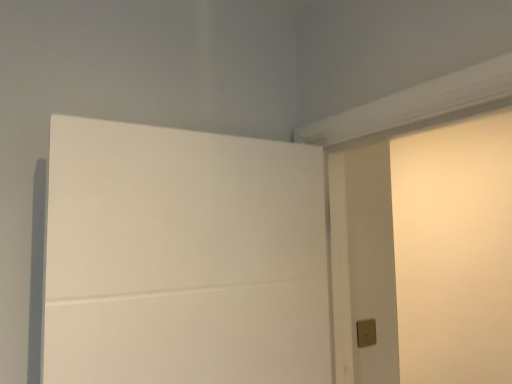
At what (x,y) coordinates should I click in order to perform the action: click on white matte door at upper left. Please return your answer as a coordinate pair (x, y). This screenshot has height=384, width=512. Looking at the image, I should click on (183, 258).

The image size is (512, 384). Describe the element at coordinates (183, 258) in the screenshot. I see `white matte door at upper left` at that location.

Where is `matte beige light switch at lower right`? matte beige light switch at lower right is located at coordinates (366, 332).

The width and height of the screenshot is (512, 384). Describe the element at coordinates (366, 332) in the screenshot. I see `matte beige light switch at lower right` at that location.

The height and width of the screenshot is (384, 512). Identify the location of white matte door at upper left. [183, 258].

Which object is positioned more to the right, matte beige light switch at lower right or white matte door at upper left?

matte beige light switch at lower right is more to the right.

Between matte beige light switch at lower right and white matte door at upper left, which one is positioned in front?

white matte door at upper left.

Which is farther, (366, 323) or (50, 270)?

The point (366, 323) is behind.

From the image's perspective, is matte beige light switch at lower right located above or below white matte door at upper left?

matte beige light switch at lower right is below white matte door at upper left.

From a real-world perspective, does matte beige light switch at lower right sit lower than white matte door at upper left?

Yes, from a real-world perspective, matte beige light switch at lower right is below white matte door at upper left.

Is matte beige light switch at lower right wider or thinner than white matte door at upper left?

Considering their sizes, matte beige light switch at lower right looks slimmer than white matte door at upper left.

Between matte beige light switch at lower right and white matte door at upper left, which one has less height?

Standing shorter between the two is matte beige light switch at lower right.

In terms of size, does matte beige light switch at lower right appear bigger or smaller than white matte door at upper left?

Considering their sizes, matte beige light switch at lower right takes up less space than white matte door at upper left.

Is white matte door at upper left a part of matte beige light switch at lower right?

No, white matte door at upper left is not inside matte beige light switch at lower right.

Based on the photo, are matte beige light switch at lower right and white matte door at upper left making contact?

No, matte beige light switch at lower right is not beside white matte door at upper left.

Is matte beige light switch at lower right facing towards white matte door at upper left?

No, matte beige light switch at lower right is not oriented towards white matte door at upper left.

How many degrees apart are the facing directions of matte beige light switch at lower right and white matte door at upper left?

There is a 1.89-degree angle between the facing directions of matte beige light switch at lower right and white matte door at upper left.

How distant is matte beige light switch at lower right from white matte door at upper left?

matte beige light switch at lower right and white matte door at upper left are 29.06 inches apart.

The image size is (512, 384). In order to click on door located above the matte beige light switch at lower right (from a real-world perspective) in this screenshot , I will do `click(183, 258)`.

Which is more to the right, white matte door at upper left or matte beige light switch at lower right?

matte beige light switch at lower right.

Based on the photo, is white matte door at upper left behind matte beige light switch at lower right?

No.

Between point (131, 332) and point (362, 335), which one is positioned in front?

The point (131, 332) is in front.

From the image's perspective, who appears lower, white matte door at upper left or matte beige light switch at lower right?

From the image's view, matte beige light switch at lower right is below.

From a real-world perspective, is white matte door at upper left on top of matte beige light switch at lower right?

Indeed, from a real-world perspective, white matte door at upper left stands above matte beige light switch at lower right.

Which of these two, white matte door at upper left or matte beige light switch at lower right, is thinner?

matte beige light switch at lower right.

Considering the relative sizes of white matte door at upper left and matte beige light switch at lower right in the image provided, is white matte door at upper left taller than matte beige light switch at lower right?

Correct, white matte door at upper left is much taller as matte beige light switch at lower right.

Is white matte door at upper left bigger or smaller than matte beige light switch at lower right?

Clearly, white matte door at upper left is larger in size than matte beige light switch at lower right.

Can matte beige light switch at lower right be found inside white matte door at upper left?

Actually, matte beige light switch at lower right is outside white matte door at upper left.

Is white matte door at upper left far away from matte beige light switch at lower right?

Actually, white matte door at upper left and matte beige light switch at lower right are a little close together.

Is white matte door at upper left aimed at matte beige light switch at lower right?

No, white matte door at upper left is not facing towards matte beige light switch at lower right.

Based on the photo, what's the angular difference between white matte door at upper left and matte beige light switch at lower right's facing directions?

There is a 1.89-degree angle between the facing directions of white matte door at upper left and matte beige light switch at lower right.

The image size is (512, 384). Identify the location of door that appears on the left of matte beige light switch at lower right. (183, 258).

At what (x,y) coordinates should I click in order to perform the action: click on light switch that appears behind the white matte door at upper left. Please return your answer as a coordinate pair (x, y). This screenshot has height=384, width=512. Looking at the image, I should click on [x=366, y=332].

Where is `light switch beneath the white matte door at upper left (from a real-world perspective)`? The height and width of the screenshot is (384, 512). light switch beneath the white matte door at upper left (from a real-world perspective) is located at coordinates (366, 332).